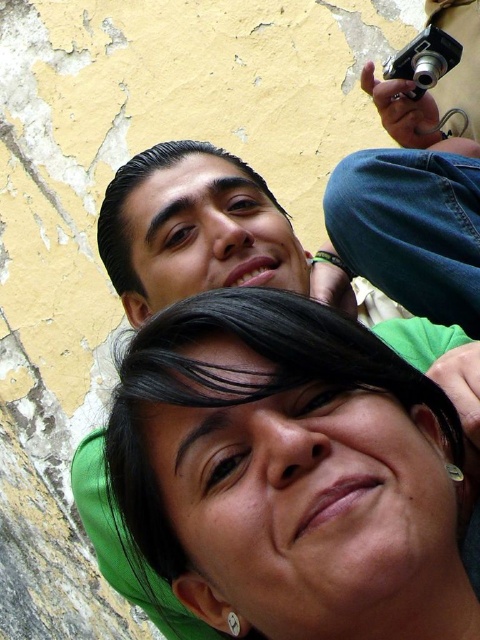
Is green matte hair at center below black plastic camera at upper right?

Yes.

Looking at this image, is green matte hair at center to the left of black plastic camera at upper right from the viewer's perspective?

Correct, you'll find green matte hair at center to the left of black plastic camera at upper right.

Locate an element on the screen. The width and height of the screenshot is (480, 640). green matte hair at center is located at coordinates (235, 410).